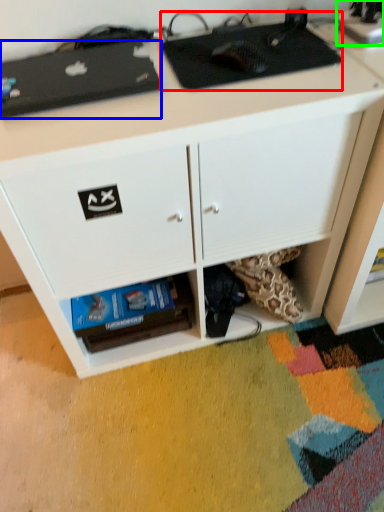
Question: Which is farther away from appliance (highlighted by a red box)? appliance (highlighted by a blue box) or appliance (highlighted by a green box)?

Choices:
 (A) appliance
 (B) appliance

Answer: (B)